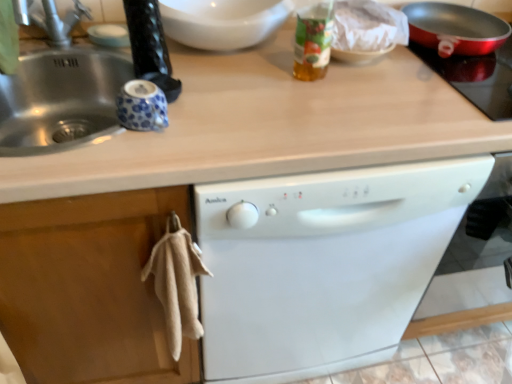
Where is `vacant area that is in front of white glossy bowl at upper center`? The height and width of the screenshot is (384, 512). vacant area that is in front of white glossy bowl at upper center is located at coordinates (239, 91).